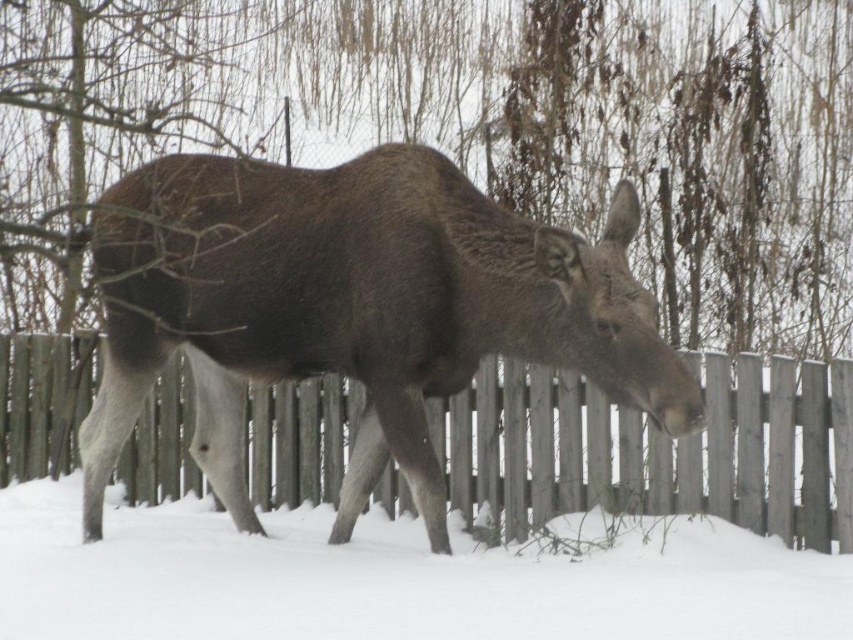
Question: Which point is farther to the camera?

Choices:
 (A) (186, 620)
 (B) (595, 372)
 (C) (584, 417)

Answer: (C)

Question: Can you confirm if brown furry deer at center is positioned below white fluffy snow at lower center?

Choices:
 (A) yes
 (B) no

Answer: (B)

Question: Among these objects, which one is nearest to the camera?

Choices:
 (A) brown furry deer at center
 (B) wooden fence at center

Answer: (A)

Question: Which of the following is the farthest from the observer?

Choices:
 (A) (256, 292)
 (B) (589, 468)

Answer: (B)

Question: From the image, what is the correct spatial relationship of white fluffy snow at lower center in relation to wooden fence at center?

Choices:
 (A) below
 (B) above

Answer: (A)

Question: From the image, what is the correct spatial relationship of white fluffy snow at lower center in relation to wooden fence at center?

Choices:
 (A) left
 (B) right

Answer: (A)